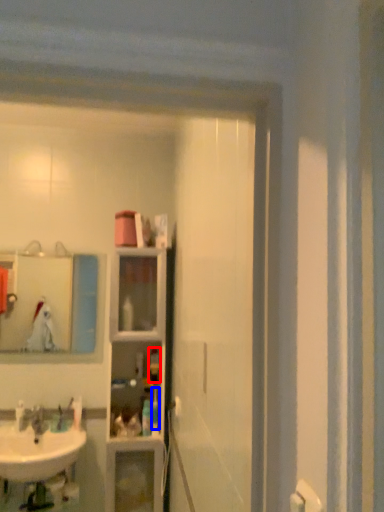
Question: Among these objects, which one is nearest to the camera, toiletry (highlighted by a red box) or toiletry (highlighted by a blue box)?

Choices:
 (A) toiletry
 (B) toiletry

Answer: (B)